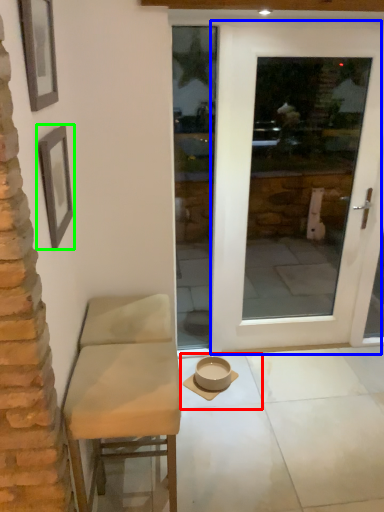
Question: Considering the real-world distances, which object is farthest from tile (highlighted by a red box)? door (highlighted by a blue box) or picture frame (highlighted by a green box)?

Choices:
 (A) door
 (B) picture frame

Answer: (B)